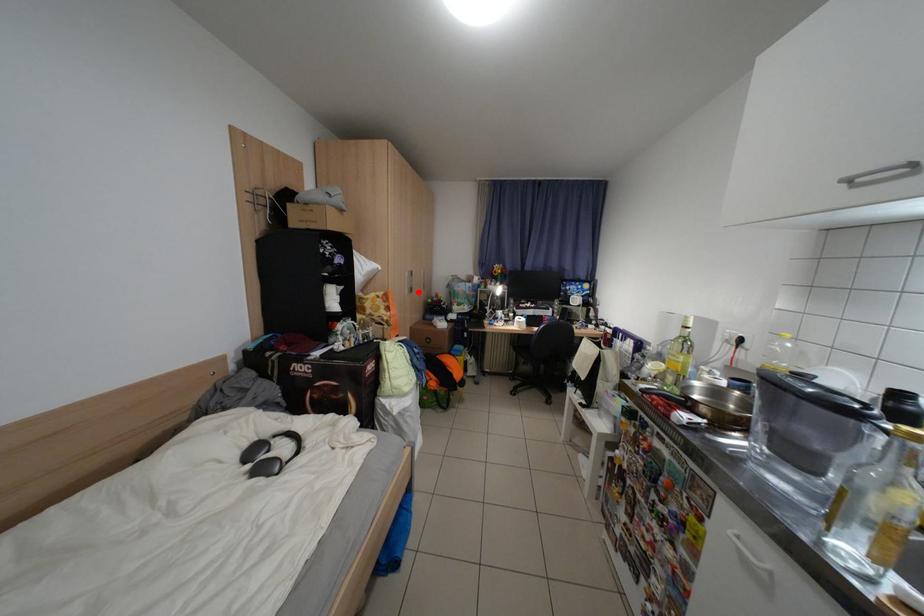
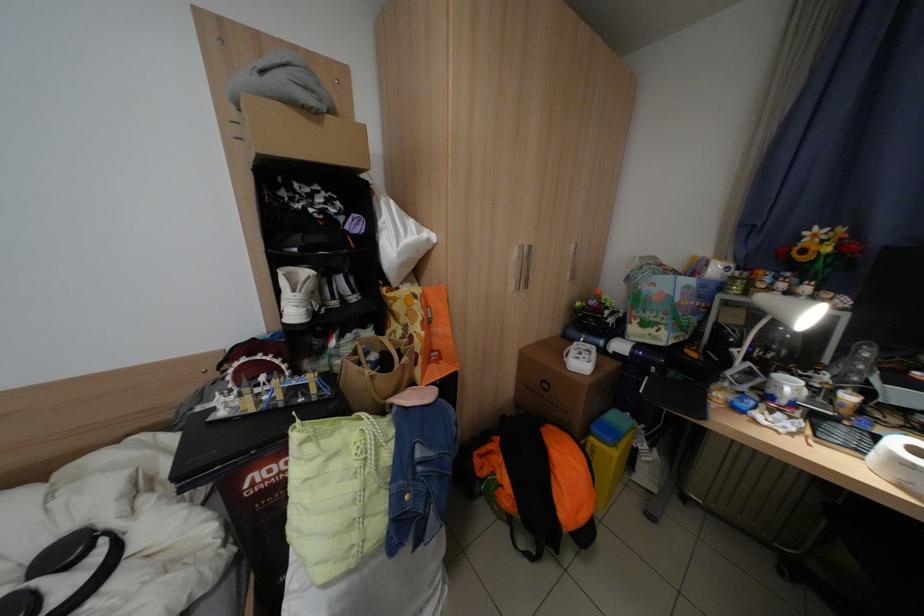
Question: I am providing you with two images of the same scene from different viewpoints. Given a red point in image1, look at the same physical point in image2. Is it:

Choices:
 (A) Closer to the viewpoint
 (B) Farther from the viewpoint

Answer: (B)